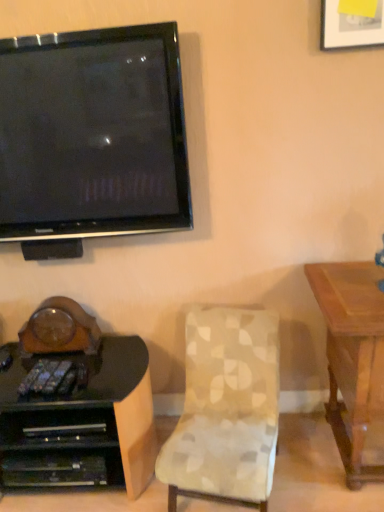
Locate an element on the screen. patterned fabric chair at center is located at coordinates (226, 409).

The height and width of the screenshot is (512, 384). What do you see at coordinates (226, 409) in the screenshot?
I see `patterned fabric chair at center` at bounding box center [226, 409].

Identify the location of black glossy television at upper left. coord(93,134).

Is patterned fabric chair at center at the left side of black glossy desk at lower left?

No.

Does patterned fabric chair at center have a smaller size compared to black glossy desk at lower left?

Yes, patterned fabric chair at center is smaller than black glossy desk at lower left.

What's the angular difference between patterned fabric chair at center and black glossy desk at lower left's facing directions?

14 degrees.

Is patterned fabric chair at center taller or shorter than black glossy desk at lower left?

patterned fabric chair at center is taller than black glossy desk at lower left.

You are a GUI agent. You are given a task and a screenshot of the screen. Output one action in this format:
    pyautogui.click(x=<x>, y=<y>)
    Task: Click on the desk directly beneath the patterned fabric chair at center (from a real-world perspective)
    
    Given the screenshot: What is the action you would take?
    pyautogui.click(x=81, y=424)

Who is taller, black glossy desk at lower left or patterned fabric chair at center?

With more height is patterned fabric chair at center.

Considering the relative sizes of black glossy desk at lower left and patterned fabric chair at center in the image provided, is black glossy desk at lower left smaller than patterned fabric chair at center?

No, black glossy desk at lower left is not smaller than patterned fabric chair at center.

Would you say black glossy desk at lower left is outside patterned fabric chair at center?

black glossy desk at lower left is positioned outside patterned fabric chair at center.

Is point (128, 54) positioned before point (199, 425)?

Yes, point (128, 54) is closer to viewer.

Which of these two, black glossy television at upper left or patterned fabric chair at center, is wider?

patterned fabric chair at center.

From the image's perspective, is black glossy television at upper left under patterned fabric chair at center?

No, from the image's perspective, black glossy television at upper left is not beneath patterned fabric chair at center.

Where is `desk to the left of black glossy television at upper left`? The image size is (384, 512). desk to the left of black glossy television at upper left is located at coordinates (81, 424).

Does black glossy desk at lower left have a smaller size compared to black glossy television at upper left?

Actually, black glossy desk at lower left might be larger than black glossy television at upper left.

Is black glossy desk at lower left oriented away from black glossy television at upper left?

No, black glossy desk at lower left's orientation is not away from black glossy television at upper left.

Is black glossy desk at lower left far away from black glossy television at upper left?

No, black glossy desk at lower left is in close proximity to black glossy television at upper left.

You are a GUI agent. You are given a task and a screenshot of the screen. Output one action in this format:
    pyautogui.click(x=<x>, y=<y>)
    Task: Click on the chair below the black glossy television at upper left (from the image's perspective)
    The width and height of the screenshot is (384, 512).
    Given the screenshot: What is the action you would take?
    pyautogui.click(x=226, y=409)

From the picture: From a real-world perspective, is patterned fabric chair at center over black glossy television at upper left?

Incorrect, from a real-world perspective, patterned fabric chair at center is lower than black glossy television at upper left.

Considering the sizes of patterned fabric chair at center and black glossy television at upper left in the image, is patterned fabric chair at center bigger or smaller than black glossy television at upper left?

patterned fabric chair at center is bigger than black glossy television at upper left.

From the image's perspective, would you say patterned fabric chair at center is shown under black glossy television at upper left?

Indeed, from the image's perspective, patterned fabric chair at center is shown beneath black glossy television at upper left.

Considering the relative sizes of black glossy television at upper left and black glossy desk at lower left in the image provided, is black glossy television at upper left wider than black glossy desk at lower left?

Incorrect, the width of black glossy television at upper left does not surpass that of black glossy desk at lower left.

Between black glossy television at upper left and black glossy desk at lower left, which one has smaller size?

black glossy television at upper left.

Is black glossy television at upper left in contact with black glossy desk at lower left?

No, black glossy television at upper left is not beside black glossy desk at lower left.

In the image, is black glossy television at upper left positioned in front of or behind black glossy desk at lower left?

In the image, black glossy television at upper left appears in front of black glossy desk at lower left.

Identify the location of chair on the right side of black glossy desk at lower left. The height and width of the screenshot is (512, 384). (226, 409).

Where is `desk below the patterned fabric chair at center (from the image's perspective)`? The height and width of the screenshot is (512, 384). desk below the patterned fabric chair at center (from the image's perspective) is located at coordinates (81, 424).

Based on the photo, which object lies further to the anchor point black glossy desk at lower left, patterned fabric chair at center or black glossy television at upper left?

The object further to black glossy desk at lower left is black glossy television at upper left.

Looking at this image, considering their positions, is black glossy television at upper left positioned further to patterned fabric chair at center than black glossy desk at lower left?

The object further to patterned fabric chair at center is black glossy television at upper left.

Estimate the real-world distances between objects in this image. Which object is closer to black glossy television at upper left, black glossy desk at lower left or patterned fabric chair at center?

patterned fabric chair at center.

When comparing their distances from black glossy desk at lower left, does black glossy television at upper left or patterned fabric chair at center seem closer?

patterned fabric chair at center is positioned closer to the anchor black glossy desk at lower left.

Considering their positions, is black glossy desk at lower left positioned further to patterned fabric chair at center than black glossy television at upper left?

black glossy television at upper left lies further to patterned fabric chair at center than the other object.

Estimate the real-world distances between objects in this image. Which object is closer to black glossy television at upper left, patterned fabric chair at center or black glossy desk at lower left?

patterned fabric chair at center lies closer to black glossy television at upper left than the other object.

Where is `chair that lies between black glossy television at upper left and black glossy desk at lower left from top to bottom`? chair that lies between black glossy television at upper left and black glossy desk at lower left from top to bottom is located at coordinates (226, 409).